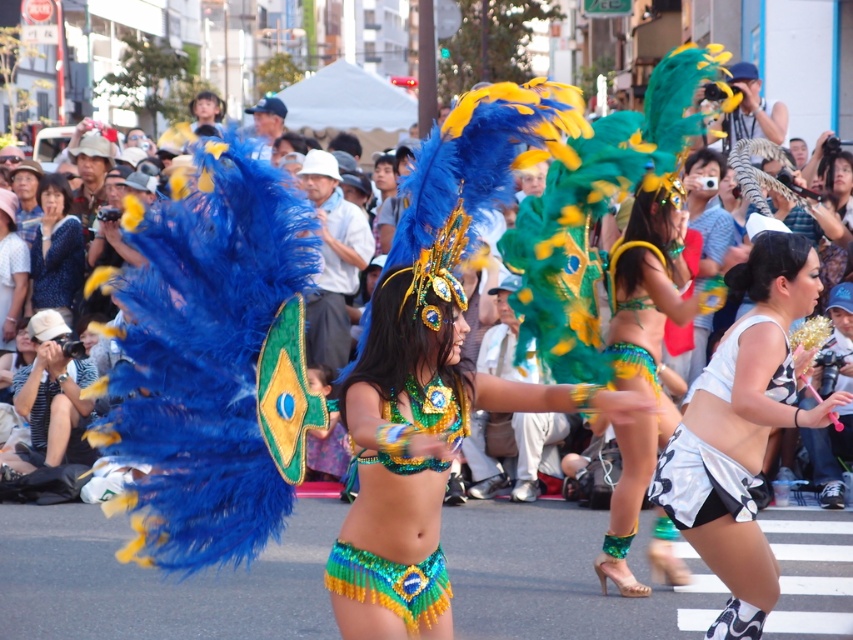
Question: Does white shiny skirt at center have a lesser width compared to green sequined bikini at center?

Choices:
 (A) no
 (B) yes

Answer: (A)

Question: Which object is the farthest from the white shiny skirt at center?

Choices:
 (A) green sequined bikini at center
 (B) white glossy shorts at lower right
 (C) blue sequined blouse at upper left

Answer: (C)

Question: Among these objects, which one is farthest from the camera?

Choices:
 (A) white glossy shorts at lower right
 (B) matte black camera at upper center
 (C) blue sequined blouse at upper left

Answer: (C)

Question: Is matte black camera at upper center positioned in front of white glossy shorts at lower right?

Choices:
 (A) no
 (B) yes

Answer: (B)

Question: Is matte black camera at upper center closer to camera compared to blue sequined blouse at upper left?

Choices:
 (A) no
 (B) yes

Answer: (B)

Question: Which point is closer to the camera?

Choices:
 (A) matte black camera at upper center
 (B) white shiny skirt at center
 (C) green sequined bikini at center
 (D) blue sequined blouse at upper left

Answer: (A)